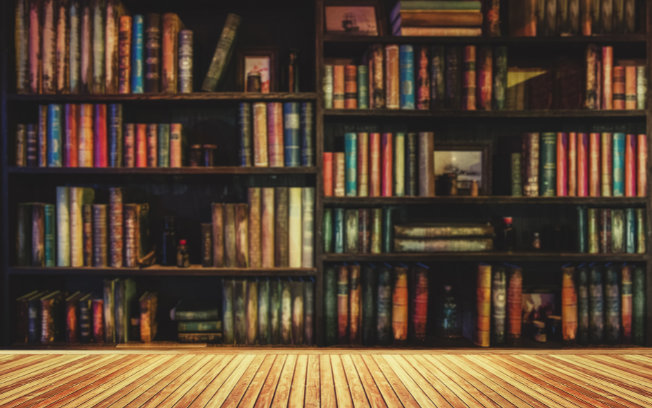
This screenshot has height=408, width=652. I want to click on shelves, so click(580, 346), click(539, 252), click(535, 199), click(537, 113), click(549, 37), click(248, 93), click(197, 168), click(178, 270).